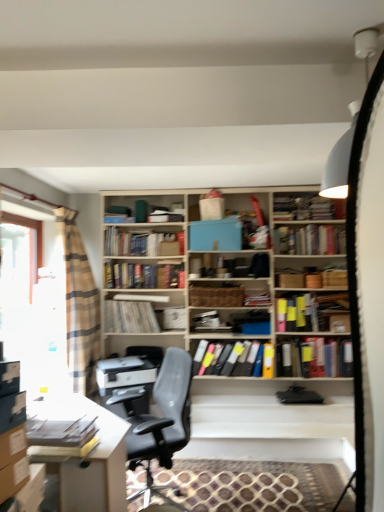
Question: Would you say white paper at center, the eighth book positioned from the front, contains black leather chair at center?

Choices:
 (A) no
 (B) yes

Answer: (A)

Question: Is white paper at center, the 1th book when ordered from back to front, further to camera compared to black leather chair at center?

Choices:
 (A) yes
 (B) no

Answer: (A)

Question: Would you consider white paper at center, the eighth book positioned from the front, to be distant from black leather chair at center?

Choices:
 (A) no
 (B) yes

Answer: (B)

Question: Considering the relative sizes of white paper at center, the 1th book when ordered from back to front, and black leather chair at center in the image provided, is white paper at center, the 1th book when ordered from back to front, smaller than black leather chair at center?

Choices:
 (A) yes
 (B) no

Answer: (A)

Question: From a real-world perspective, is white paper at center, the eighth book positioned from the front, physically below black leather chair at center?

Choices:
 (A) no
 (B) yes

Answer: (A)

Question: Based on their positions, is wooden bookshelf at center, which is the fifth book from front to back, located to the left or right of multicolored file folders at center, the 7th book when ordered from back to front?

Choices:
 (A) left
 (B) right

Answer: (A)

Question: Is point (147, 330) positioned closer to the camera than point (231, 356)?

Choices:
 (A) closer
 (B) farther

Answer: (A)

Question: Which is correct: wooden bookshelf at center, which is the fifth book from front to back, is inside multicolored file folders at center, the 7th book when ordered from back to front, or outside of it?

Choices:
 (A) outside
 (B) inside

Answer: (A)

Question: Relative to multicolored file folders at center, which ranks as the 2th book in front-to-back order, is wooden bookshelf at center, which is the fifth book from front to back, in front or behind?

Choices:
 (A) behind
 (B) front

Answer: (A)

Question: From the image's perspective, relative to beige plaid curtain at left, is clear glass window at left above or below?

Choices:
 (A) below
 (B) above

Answer: (B)

Question: Based on their positions, is clear glass window at left located to the left or right of beige plaid curtain at left?

Choices:
 (A) right
 (B) left

Answer: (B)

Question: Is point (24, 369) closer or farther from the camera than point (72, 210)?

Choices:
 (A) closer
 (B) farther

Answer: (A)

Question: Looking at the image, does clear glass window at left seem bigger or smaller compared to beige plaid curtain at left?

Choices:
 (A) small
 (B) big

Answer: (A)

Question: Considering their positions, is matte white desk at lower left located in front of or behind beige plaid curtain at left?

Choices:
 (A) behind
 (B) front

Answer: (B)

Question: Considering the positions of matte white desk at lower left and beige plaid curtain at left in the image, is matte white desk at lower left wider or thinner than beige plaid curtain at left?

Choices:
 (A) wide
 (B) thin

Answer: (A)